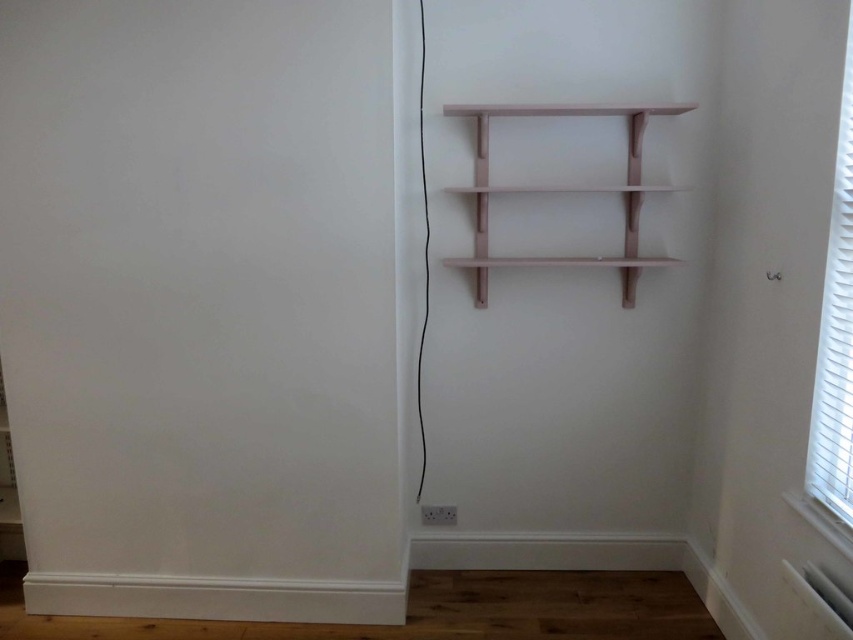
Question: Can you confirm if white textured blinds at right is positioned below matte pink shelf at upper center?

Choices:
 (A) no
 (B) yes

Answer: (B)

Question: Which point is farther from the camera taking this photo?

Choices:
 (A) (639, 132)
 (B) (843, 108)

Answer: (A)

Question: Does white textured blinds at right appear on the left side of matte pink shelf at upper center?

Choices:
 (A) no
 (B) yes

Answer: (A)

Question: Does white textured blinds at right appear under matte pink shelf at upper center?

Choices:
 (A) yes
 (B) no

Answer: (A)

Question: Which point is farther from the camera taking this photo?

Choices:
 (A) (474, 193)
 (B) (830, 496)

Answer: (A)

Question: Which of the following is the farthest from the observer?

Choices:
 (A) (639, 269)
 (B) (844, 390)

Answer: (A)